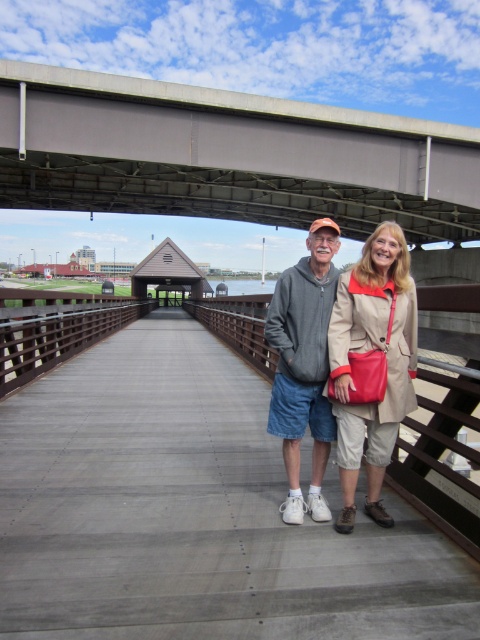
Can you confirm if concrete bridge at upper center is positioned below beige textured coat at center?

Incorrect, concrete bridge at upper center is not positioned below beige textured coat at center.

The width and height of the screenshot is (480, 640). Describe the element at coordinates (228, 156) in the screenshot. I see `concrete bridge at upper center` at that location.

I want to click on concrete bridge at upper center, so click(228, 156).

Is beige textured coat at center further to camera compared to gray fleece jacket at center?

No, it is in front of gray fleece jacket at center.

What do you see at coordinates (372, 364) in the screenshot? I see `beige textured coat at center` at bounding box center [372, 364].

Which is behind, point (370, 496) or point (282, 512)?

Point (370, 496)

At what (x,y) coordinates should I click in order to perform the action: click on beige textured coat at center. Please return your answer as a coordinate pair (x, y). This screenshot has height=640, width=480. Looking at the image, I should click on (372, 364).

Which is above, concrete bridge at upper center or gray fleece jacket at center?

concrete bridge at upper center

Is concrete bridge at upper center positioned at the back of gray fleece jacket at center?

That is True.

Is point (54, 88) less distant than point (316, 474)?

No, (54, 88) is further to viewer.

Where is `concrete bridge at upper center`? concrete bridge at upper center is located at coordinates (228, 156).